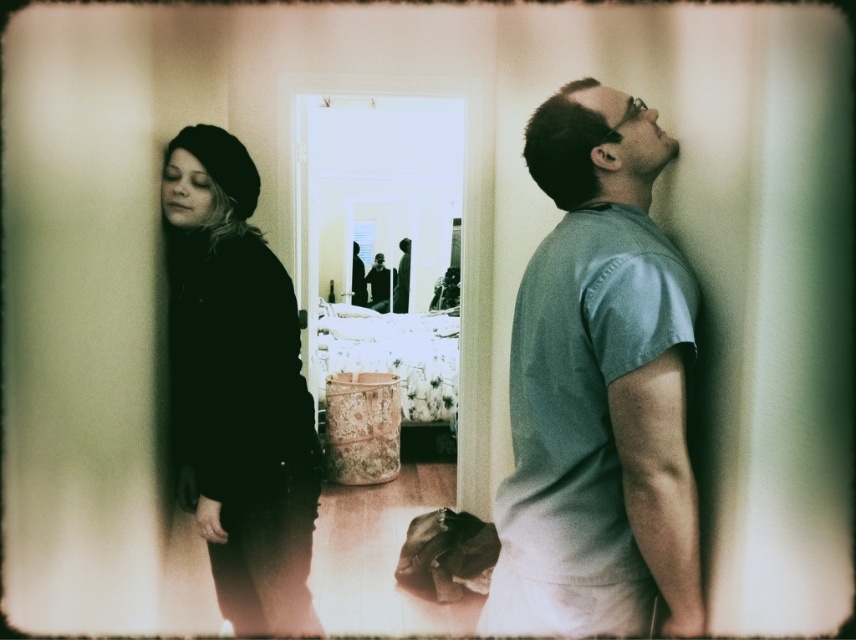
What do you see at coordinates (598, 390) in the screenshot?
I see `dark matte jacket at left` at bounding box center [598, 390].

At what (x,y) coordinates should I click in order to perform the action: click on dark matte jacket at left. Please return your answer as a coordinate pair (x, y). Image resolution: width=856 pixels, height=640 pixels. Looking at the image, I should click on (598, 390).

Can you confirm if dark matte jacket at left is smaller than black matte beret at left?

Correct, dark matte jacket at left occupies less space than black matte beret at left.

Describe the element at coordinates (598, 390) in the screenshot. This screenshot has width=856, height=640. I see `dark matte jacket at left` at that location.

Where is `dark matte jacket at left`? The height and width of the screenshot is (640, 856). dark matte jacket at left is located at coordinates (598, 390).

Is light blue t-shirt at right positioned behind black matte beret at left?

No.

Does light blue t-shirt at right appear under black matte beret at left?

Actually, light blue t-shirt at right is above black matte beret at left.

What are the coordinates of `light blue t-shirt at right` in the screenshot? It's located at (598, 388).

Locate an element on the screen. Image resolution: width=856 pixels, height=640 pixels. light blue t-shirt at right is located at coordinates (598, 388).